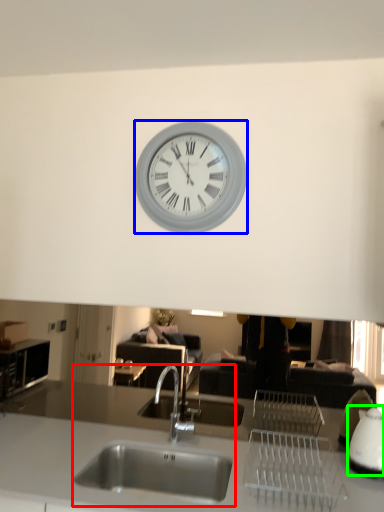
Question: Considering the real-world distances, which object is farthest from sink (highlighted by a red box)? wall clock (highlighted by a blue box) or appliance (highlighted by a green box)?

Choices:
 (A) wall clock
 (B) appliance

Answer: (A)